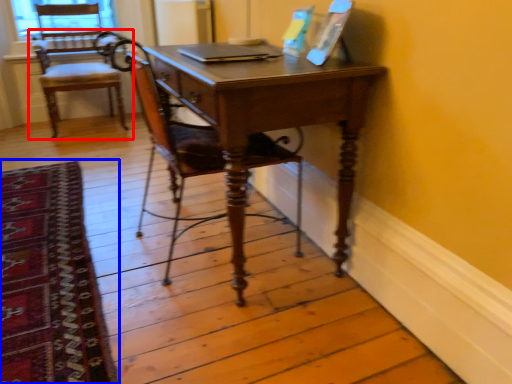
Question: Which object is closer to the camera taking this photo, chair (highlighted by a red box) or mat (highlighted by a blue box)?

Choices:
 (A) chair
 (B) mat

Answer: (B)